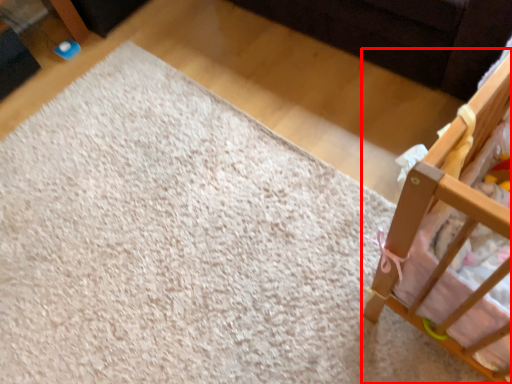
Question: From the image's perspective, where is infant bed (annotated by the red box) located in relation to mat in the image?

Choices:
 (A) above
 (B) below

Answer: (A)